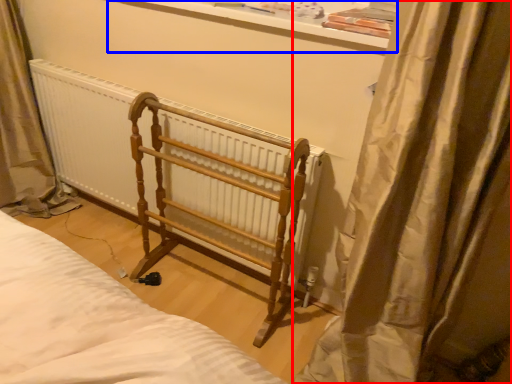
Question: Among these objects, which one is farthest to the camera, curtain (highlighted by a red box) or window sill (highlighted by a blue box)?

Choices:
 (A) curtain
 (B) window sill

Answer: (B)